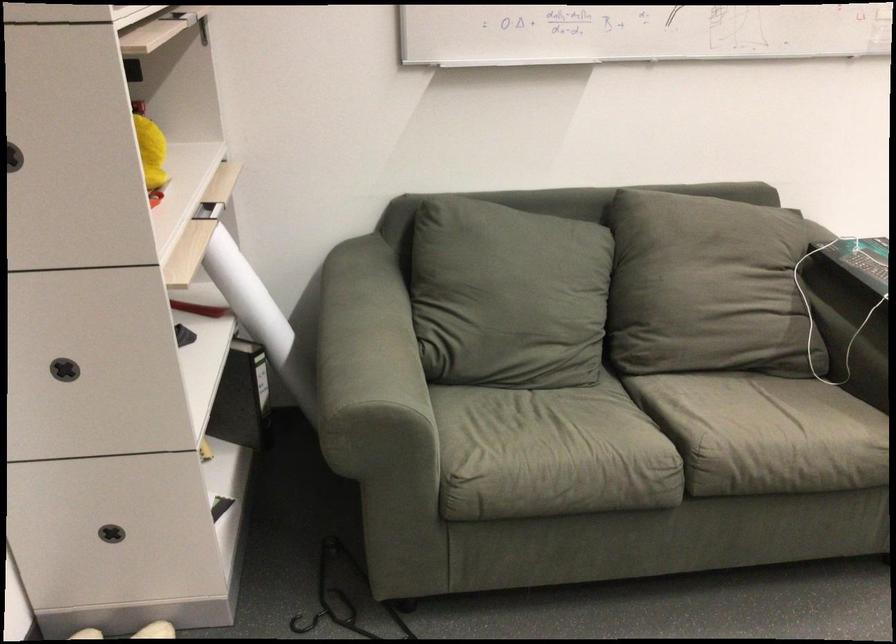
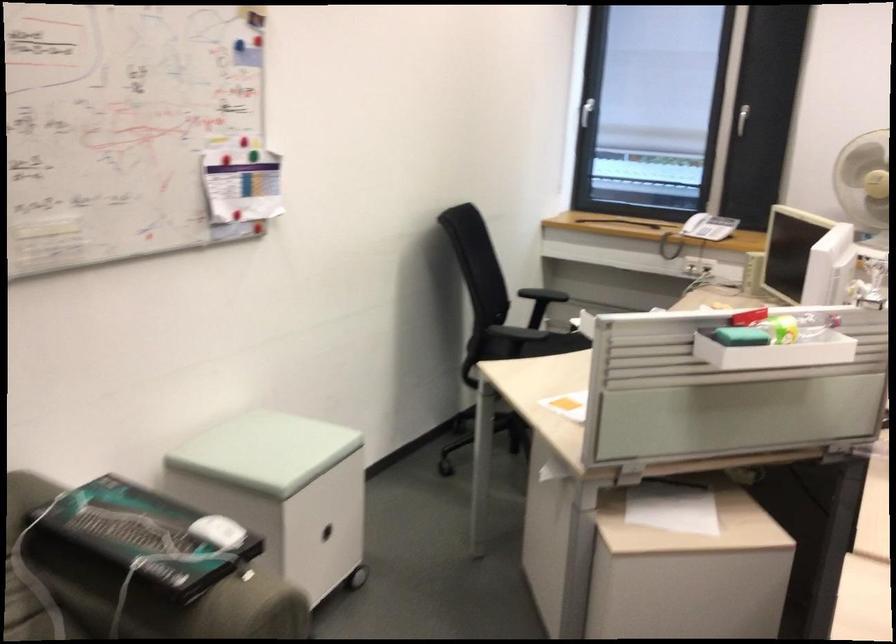
Question: The first image is from the beginning of the video and the second image is from the end. How did the camera likely rotate when shooting the video?

Choices:
 (A) Left
 (B) Right
 (C) Up
 (D) Down

Answer: (B)